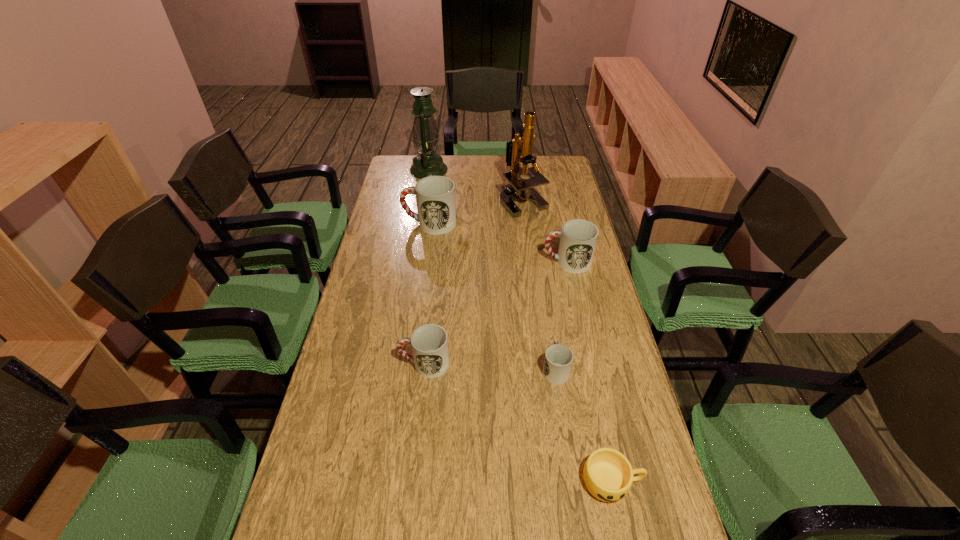
Locate an element on the screen. The image size is (960, 540). vacant space at the far edge of the desktop is located at coordinates (529, 167).

Locate an element on the screen. Image resolution: width=960 pixels, height=540 pixels. free space at the left edge of the desktop is located at coordinates (388, 244).

Image resolution: width=960 pixels, height=540 pixels. Find the location of `vacant space at the right edge`. vacant space at the right edge is located at coordinates (545, 211).

Where is `vacant space in between the farthest object and the microscope`? The image size is (960, 540). vacant space in between the farthest object and the microscope is located at coordinates (476, 185).

Image resolution: width=960 pixels, height=540 pixels. I want to click on free space between the second tallest cup and the gold microscope, so pyautogui.click(x=545, y=231).

Locate an element on the screen. This screenshot has height=540, width=960. free space between the fourth shortest object and the fourth tallest cup is located at coordinates (561, 315).

Identify the location of free area in between the gold microscope and the third smallest red cup. (545, 231).

Locate an element on the screen. Image resolution: width=960 pixels, height=540 pixels. vacant space that is in between the farthest red cup and the third shortest cup is located at coordinates (427, 293).

Find the location of a particular element. The width and height of the screenshot is (960, 540). vacant region between the nearest object and the fifth tallest object is located at coordinates (518, 423).

Where is `object that stands as the sixth closest to the biggest red cup`? The height and width of the screenshot is (540, 960). object that stands as the sixth closest to the biggest red cup is located at coordinates (608, 475).